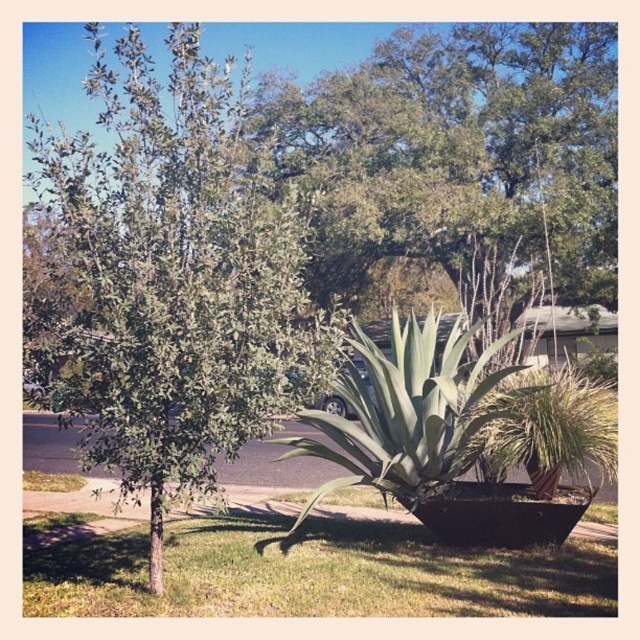
In the scene shown: You are standing in the outdoor scene and want to take a photo of both the point at coordinates point (61, 346) and the point at coordinates point (364, 605). Which point should you focus on first to ensure both are in focus?

You should focus on the point at coordinates point (61, 346) first because it is closer to the camera than the point at coordinates point (364, 605). This ensures the closer point is in focus, and the farther point will also be in focus due to depth of field.

You are standing in the outdoor scene and want to take a photo of the two points. Which point, point [509,212] or point [26,586], will appear larger in the photo?

Point [509,212] will appear larger in the photo because it is closer to the camera than point [26,586].

You are standing in the garden looking at the green leafy tree at left and the green grass at lower center. Which object is positioned higher relative to the other?

The green leafy tree at left is positioned higher than the green grass at lower center.